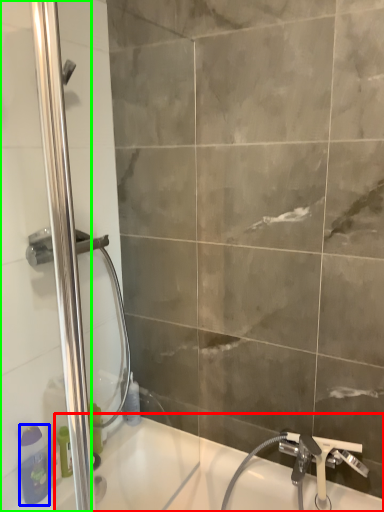
Question: Which object is positioned closest to bath (highlighted by a red box)? Select from toiletry (highlighted by a blue box) and screen door (highlighted by a green box).

Choices:
 (A) toiletry
 (B) screen door

Answer: (A)